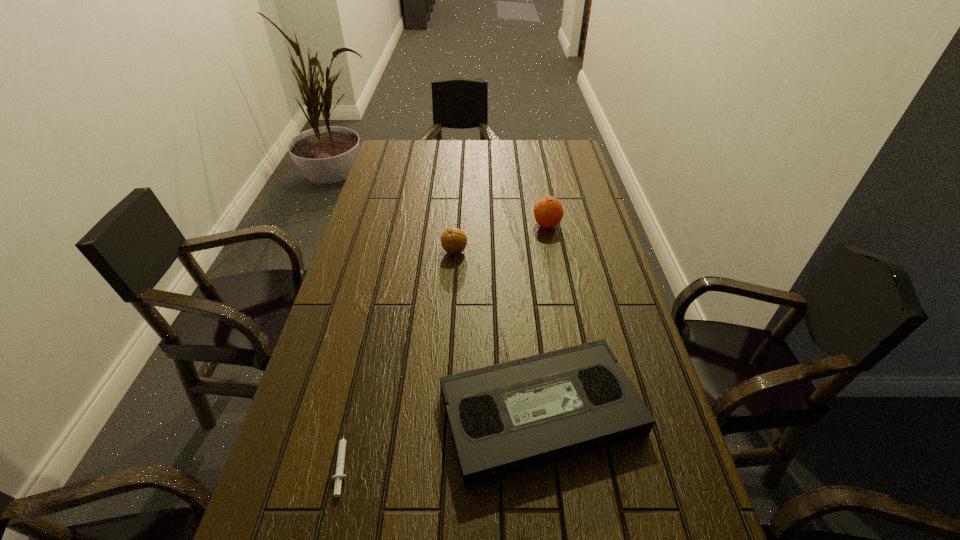
At what (x,y) coordinates should I click in order to perform the action: click on free space that satisfies the following two spatial constraints: 1. on the back side of the farther orange; 2. on the left side of the left orange. Please return your answer as a coordinate pair (x, y). The height and width of the screenshot is (540, 960). Looking at the image, I should click on (456, 225).